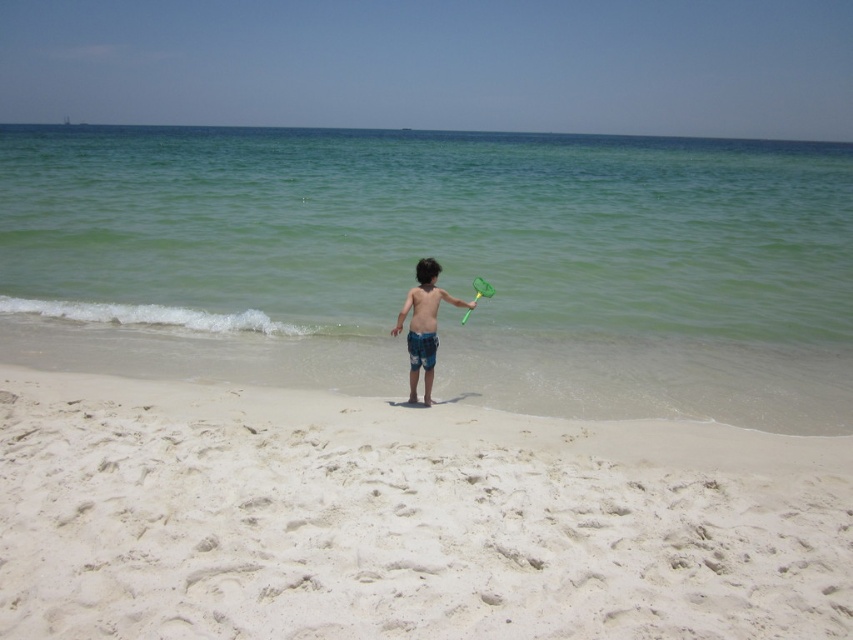
You are standing at the point marked as point (x=404, y=518) on the beach. Looking around, what is the most prominent feature directly beneath your feet?

The point (x=404, y=518) corresponds to the white sandy beach at center, so the most prominent feature directly beneath your feet is the white sandy beach at center.

You are a parent watching your child at the beach. You see the clear water at center and the green plastic paddle at center. Which object is closer to the child?

The green plastic paddle at center is closer to the child because the clear water at center is positioned over it, meaning the paddle is underneath the water and thus closer to the child.

Consider the image. You are a beachcomber searching for items on the white sandy beach at center. You notice the green plastic paddle at center nearby. Which object is lower to the ground?

The white sandy beach at center is lower to the ground compared to the green plastic paddle at center.